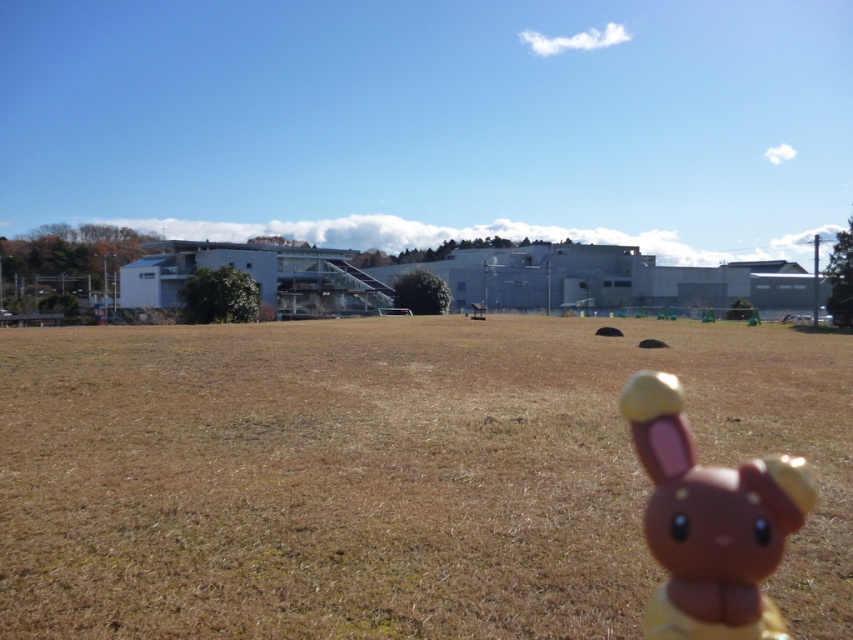
Between point (717, 387) and point (741, 552), which one is positioned behind?

Positioned behind is point (717, 387).

Image resolution: width=853 pixels, height=640 pixels. I want to click on brown grass at center, so click(386, 474).

Is point (128, 433) behind point (781, 632)?

Yes.

The height and width of the screenshot is (640, 853). I want to click on brown grass at center, so click(386, 474).